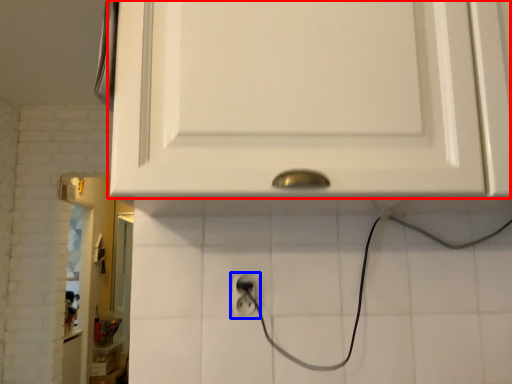
Question: Which point is closer to the camera, cabinetry (highlighted by a red box) or power plugs and sockets (highlighted by a blue box)?

Choices:
 (A) cabinetry
 (B) power plugs and sockets

Answer: (A)